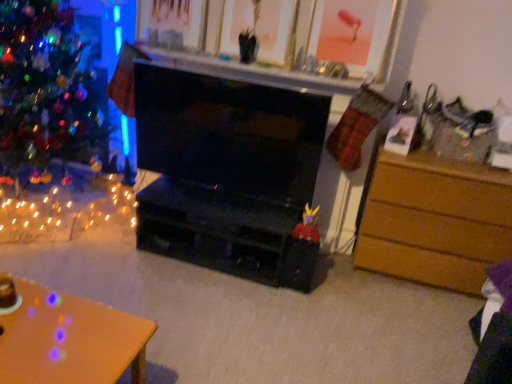
Where is `vacant space situated above orange wood desk at lower left (from a real-world perspective)`? vacant space situated above orange wood desk at lower left (from a real-world perspective) is located at coordinates (52, 329).